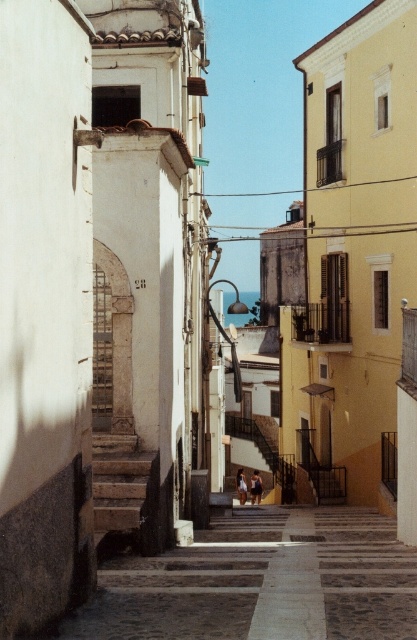
A tourist is standing at the point marked as point (95, 508) and wants to take a photo of the entire street scene. They have a camera with a 50mm lens. Considering the distance between the two points, will the tourist be able to capture the entire scene in one shot without moving?

The two points are 9.37 meters apart. With a 50mm lens, the field of view at that distance is sufficient to capture the entire scene in one shot without needing to move.